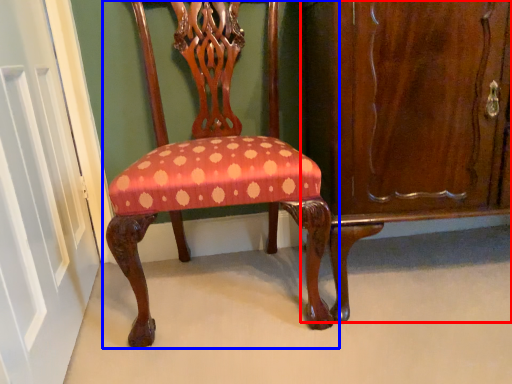
Question: Which point is closer to the camera, dresser (highlighted by a red box) or chair (highlighted by a blue box)?

Choices:
 (A) dresser
 (B) chair

Answer: (B)